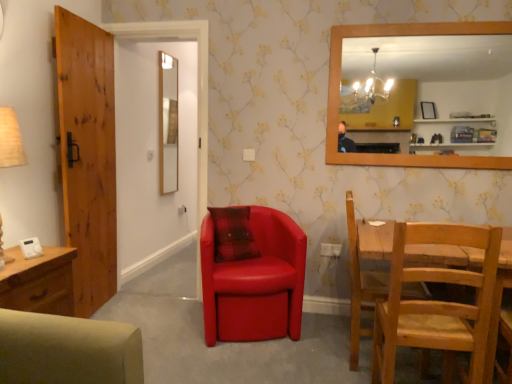
The height and width of the screenshot is (384, 512). I want to click on vacant area on top of wooden frame mirror at upper right, the second mirror in the left-to-right sequence (from a real-world perspective), so [434, 16].